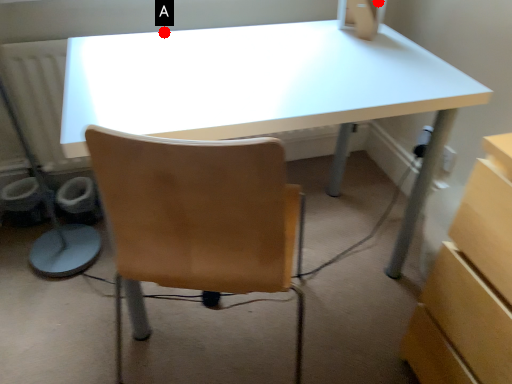
Question: Two points are circled on the image, labeled by A and B beside each circle. Which point is closer to the camera?

Choices:
 (A) A is closer
 (B) B is closer

Answer: (A)